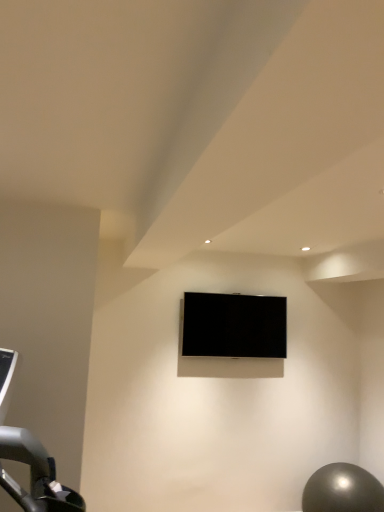
Question: From a real-world perspective, relative to metallic gray ball at lower right, is black glossy tv at center vertically above or below?

Choices:
 (A) above
 (B) below

Answer: (A)

Question: In terms of height, does black glossy tv at center look taller or shorter compared to metallic gray ball at lower right?

Choices:
 (A) tall
 (B) short

Answer: (A)

Question: Is point (215, 336) closer or farther from the camera than point (350, 466)?

Choices:
 (A) farther
 (B) closer

Answer: (A)

Question: Considering their positions, is metallic gray ball at lower right located in front of or behind black glossy tv at center?

Choices:
 (A) behind
 (B) front

Answer: (B)

Question: From their relative heights in the image, would you say metallic gray ball at lower right is taller or shorter than black glossy tv at center?

Choices:
 (A) tall
 (B) short

Answer: (B)

Question: Does point click(380, 501) appear closer or farther from the camera than point click(221, 312)?

Choices:
 (A) closer
 (B) farther

Answer: (A)

Question: Which is correct: metallic gray ball at lower right is inside black glossy tv at center, or outside of it?

Choices:
 (A) outside
 (B) inside

Answer: (A)